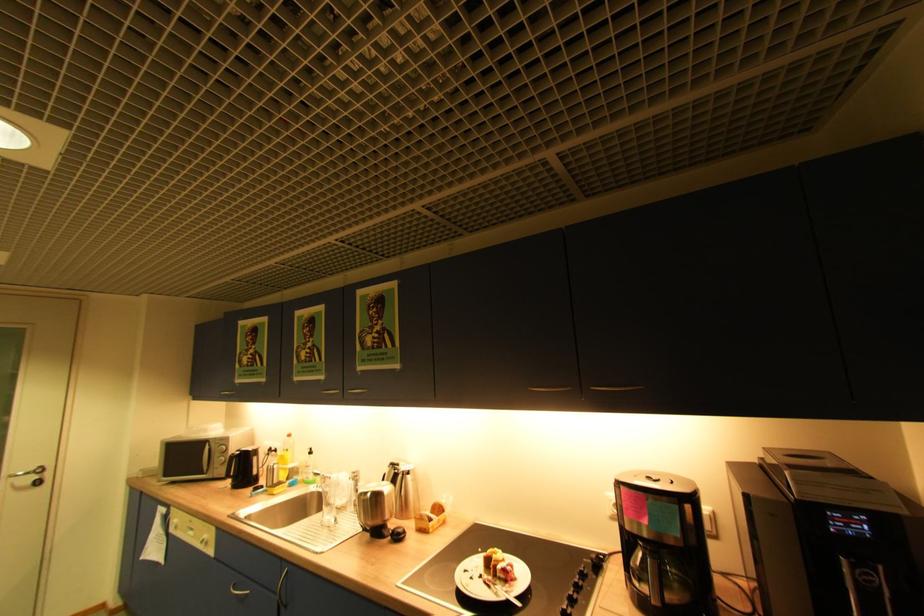
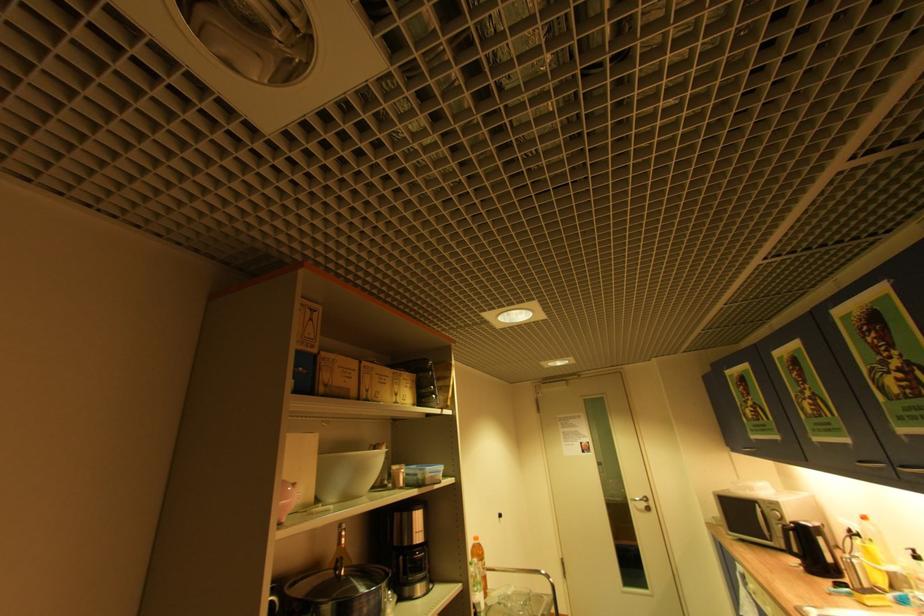
How did the camera likely rotate?

The camera's rotation is toward left-up.